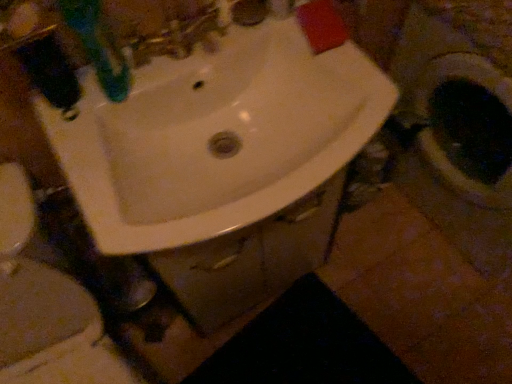
Question: In terms of height, does green plastic toothbrush at upper left look taller or shorter compared to black matte rug at lower center?

Choices:
 (A) tall
 (B) short

Answer: (A)

Question: Considering the positions of green plastic toothbrush at upper left and black matte rug at lower center in the image, is green plastic toothbrush at upper left bigger or smaller than black matte rug at lower center?

Choices:
 (A) small
 (B) big

Answer: (A)

Question: Which object is positioned closest to the black matte rug at lower center?

Choices:
 (A) white glossy toilet at center
 (B) white glossy sink at center
 (C) green plastic toothbrush at upper left

Answer: (A)

Question: Which is farther from the white glossy sink at center?

Choices:
 (A) white glossy toilet at center
 (B) green plastic toothbrush at upper left
 (C) black matte rug at lower center

Answer: (C)